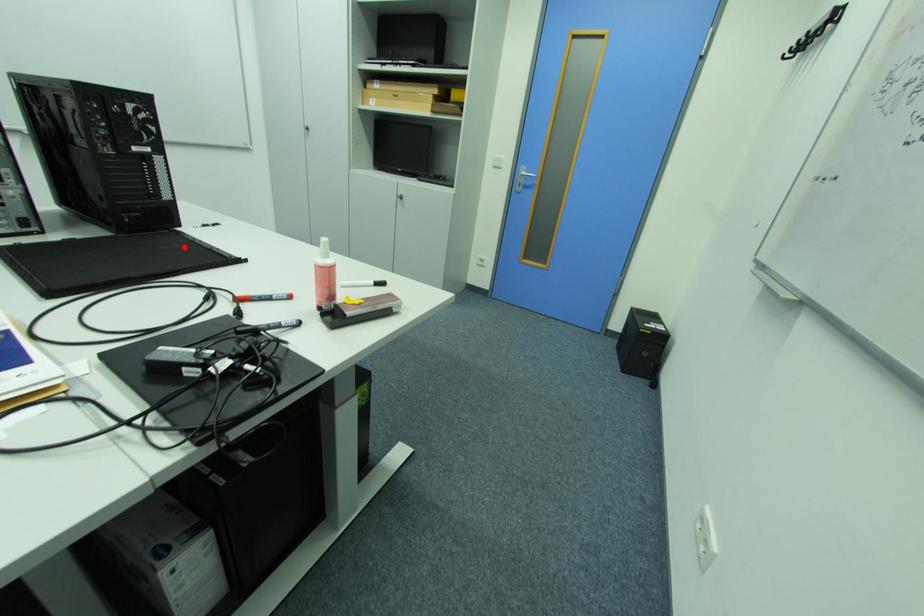
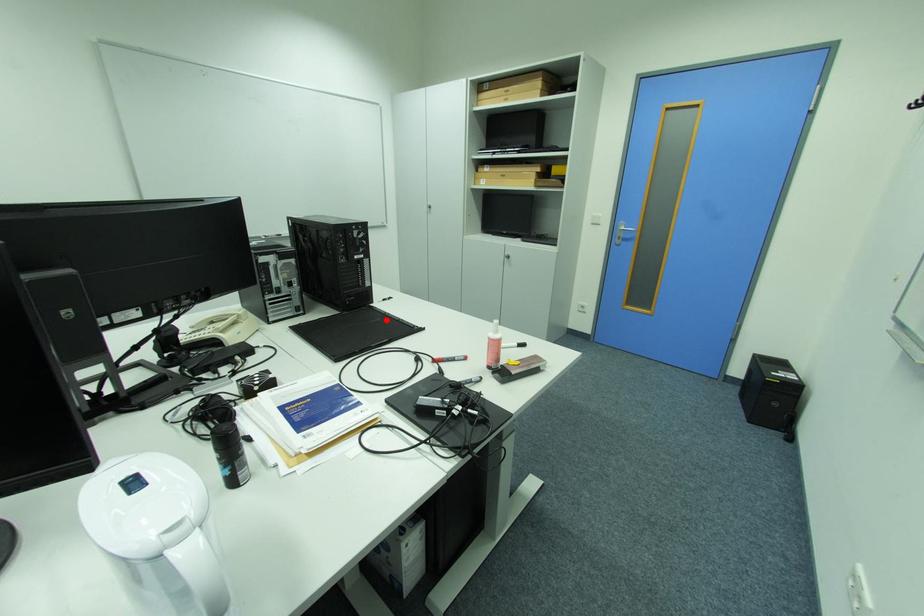
I am providing you with two images of the same scene from different viewpoints. A red point is marked on the first image and another point is marked on the second image. Does the point marked in image1 correspond to the same location as the one in image2?

Yes